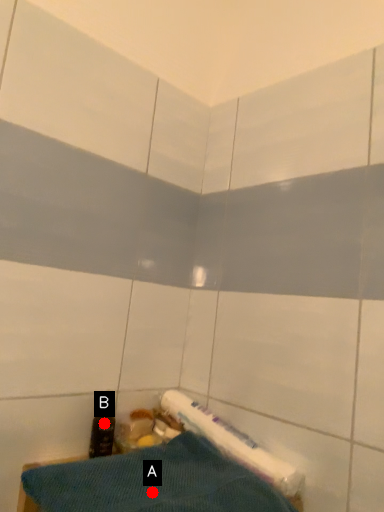
Question: Two points are circled on the image, labeled by A and B beside each circle. Which point is farther to the camera?

Choices:
 (A) A is further
 (B) B is further

Answer: (B)